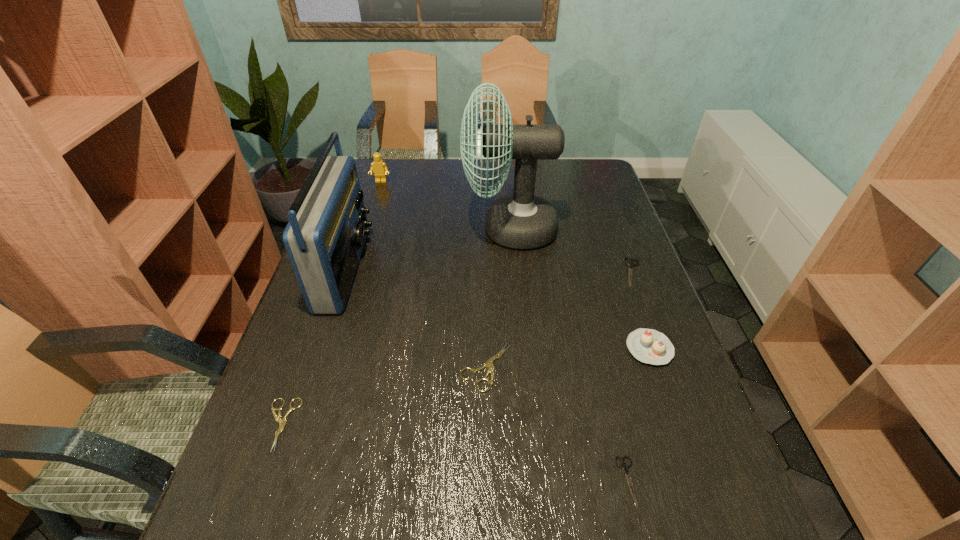
You are a GUI agent. You are given a task and a screenshot of the screen. Output one action in this format:
    pyautogui.click(x=<x>, y=<y>)
    Task: Click on the object identified as the third closest to the blue radio receiver
    
    Given the screenshot: What is the action you would take?
    pyautogui.click(x=521, y=221)

I want to click on object that is the fifth closest to the sixth shortest object, so click(x=282, y=421).

Where is `shears that is the closest to the tallest object`? shears that is the closest to the tallest object is located at coordinates (630, 264).

Locate an element on the screen. shears that stands as the second closest to the second farthest shears is located at coordinates (282, 421).

Locate an element on the screen. The image size is (960, 540). free spot that satisfies the following two spatial constraints: 1. in front of the rightmost shears where the airflow is directed; 2. on the left side of the tallest object is located at coordinates (514, 272).

Locate an element on the screen. This screenshot has height=540, width=960. vacant space that satisfies the following two spatial constraints: 1. on the front panel of the bigger beige shears; 2. on the left side of the radio receiver is located at coordinates (314, 367).

Where is `free location that satisfies the following two spatial constraints: 1. in front of the rightmost shears where the airflow is directed; 2. on the right side of the tallest object`? This screenshot has width=960, height=540. free location that satisfies the following two spatial constraints: 1. in front of the rightmost shears where the airflow is directed; 2. on the right side of the tallest object is located at coordinates (514, 272).